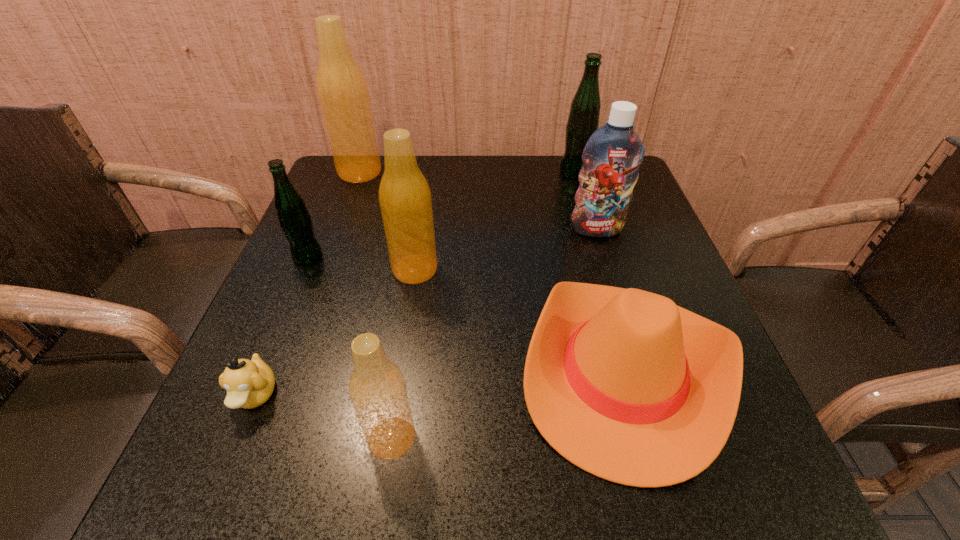
What are the coordinates of `the nearest tan beer bottle` in the screenshot? It's located at (377, 388).

The image size is (960, 540). Identify the location of the seventh tallest object. (623, 383).

The width and height of the screenshot is (960, 540). What are the coordinates of `tan duckling` in the screenshot? It's located at (249, 383).

Locate an element on the screen. This screenshot has height=540, width=960. duckling is located at coordinates (249, 383).

Locate an element on the screen. free space located 0.280m on the front of the tallest object is located at coordinates (329, 254).

Identify the location of free region located on the left of the farther green beer bottle. The width and height of the screenshot is (960, 540). (434, 172).

Locate an element on the screen. vacant space located on the back of the second biggest tan beer bottle is located at coordinates (420, 234).

I want to click on vacant space located 0.090m on the front label of the blue shampoo, so click(x=608, y=266).

Locate an element on the screen. This screenshot has height=540, width=960. vacant area situated on the front of the smaller green beer bottle is located at coordinates (229, 439).

Locate an element on the screen. This screenshot has width=960, height=540. vacant region located on the right of the smallest tan beer bottle is located at coordinates (483, 438).